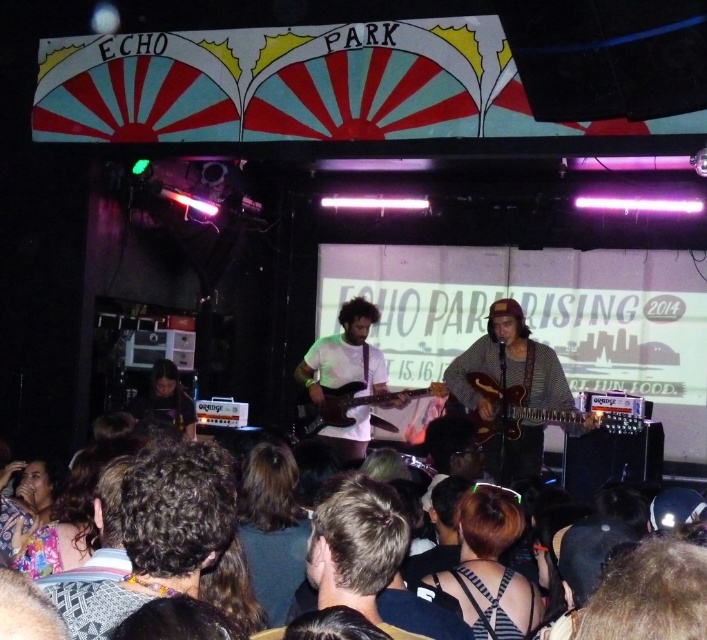
Can you confirm if dark brown hair at center is positioned to the right of matte brown guitar at center?

In fact, dark brown hair at center is to the left of matte brown guitar at center.

Is point (259, 468) closer to camera compared to point (498, 387)?

Yes.

Where is `dark brown hair at center`? This screenshot has height=640, width=707. dark brown hair at center is located at coordinates (271, 528).

Looking at this image, is black mesh top at center wider than dark brown hair at center?

Yes.

Between black mesh top at center and dark brown hair at center, which one has more height?

With more height is dark brown hair at center.

Does point (479, 627) come behind point (271, 465)?

No.

Locate an element on the screen. black mesh top at center is located at coordinates (490, 566).

Does black mesh top at center have a smaller size compared to white matte guitar at center?

Yes, black mesh top at center is smaller than white matte guitar at center.

Does black mesh top at center come in front of white matte guitar at center?

That is True.

Which is in front, point (506, 579) or point (332, 376)?

Positioned in front is point (506, 579).

Identify the location of black mesh top at center. The image size is (707, 640). (490, 566).